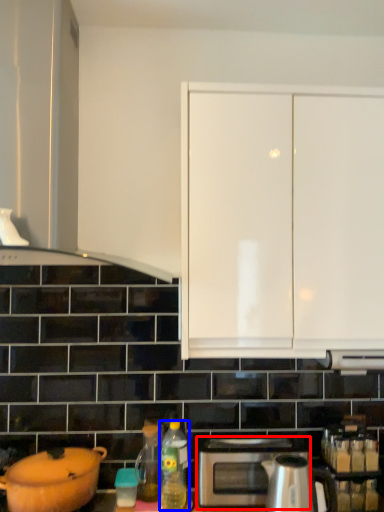
Question: Among these objects, which one is farthest to the camera, microwave (highlighted by a red box) or bottle (highlighted by a blue box)?

Choices:
 (A) microwave
 (B) bottle

Answer: (A)